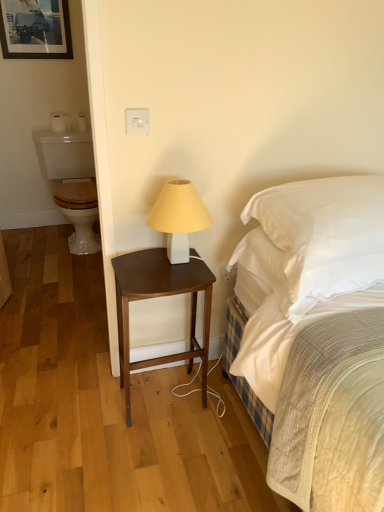
Where is `vacant space to the left of white matte table lamp at center`? vacant space to the left of white matte table lamp at center is located at coordinates (139, 263).